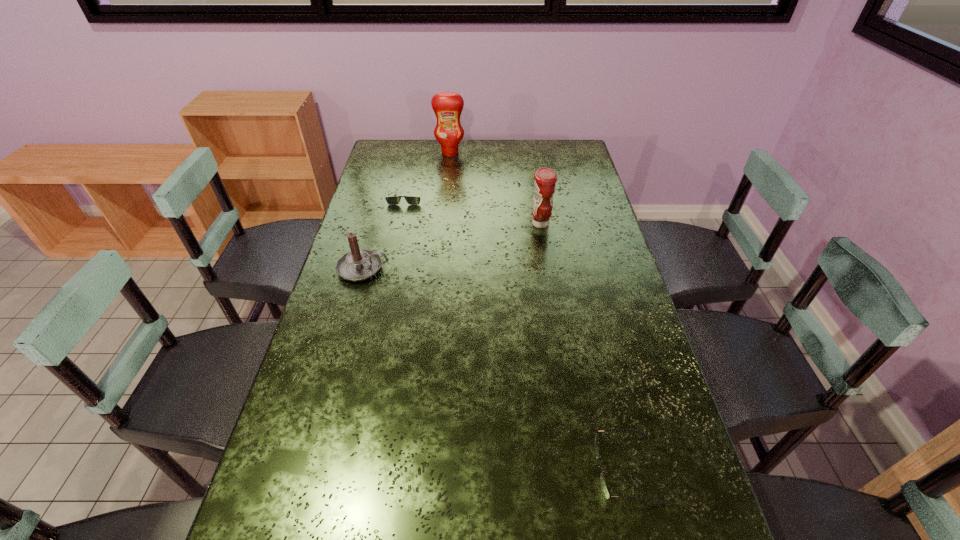
Identify the location of vacant area that lies between the fourth nearest object and the candle. Image resolution: width=960 pixels, height=540 pixels. (384, 232).

You are a GUI agent. You are given a task and a screenshot of the screen. Output one action in this format:
    pyautogui.click(x=<x>, y=<y>)
    Task: Click on the empty space between the candle and the sunglasses
    The image size is (960, 540).
    Given the screenshot: What is the action you would take?
    (x=384, y=232)

This screenshot has height=540, width=960. Identify the location of vacant area between the taller condiment and the shorter condiment. (495, 188).

Locate which object is the closest to the taller condiment. Please provide its 2D coordinates. Your answer should be formatted as a tuple, i.e. [(x, y)], where the tuple contains the x and y coordinates of a point satisfying the conditions above.

[(393, 200)]

This screenshot has width=960, height=540. What are the coordinates of `object that stands as the third closest to the candle` in the screenshot? It's located at (447, 106).

The image size is (960, 540). I want to click on vacant space that satisfies the following two spatial constraints: 1. on the label side of the right condiment; 2. on the right side of the tallest object, so click(x=443, y=224).

At what (x,y) coordinates should I click in order to perform the action: click on vacant region that satisfies the following two spatial constraints: 1. on the label side of the nearer condiment; 2. on the left side of the taller condiment. Please return your answer as a coordinate pair (x, y). The height and width of the screenshot is (540, 960). Looking at the image, I should click on (443, 224).

What are the coordinates of `free spot that satisfies the following two spatial constraints: 1. on the front-facing side of the second farthest object; 2. on the side of the candle with the handle loop` in the screenshot? It's located at (390, 268).

Identify the location of vacant region that satisfies the following two spatial constraints: 1. on the front-facing side of the shorter condiment; 2. on the left side of the sunglasses. This screenshot has height=540, width=960. (399, 224).